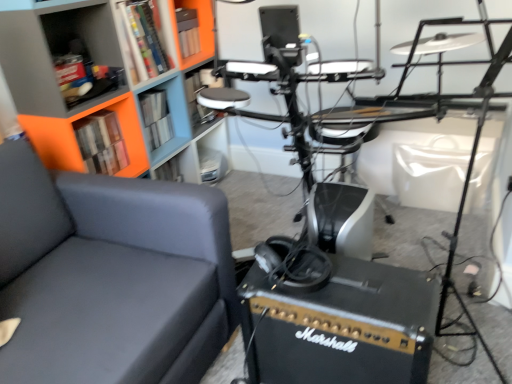
Question: Is matte plastic shelf at upper left, the 2th shelf in the back-to-front sequence, surrounded by orange matte bookcase at upper left?

Choices:
 (A) yes
 (B) no

Answer: (A)

Question: Can you confirm if orange matte bookcase at upper left is smaller than matte plastic shelf at upper left, the 2th shelf in the back-to-front sequence?

Choices:
 (A) yes
 (B) no

Answer: (B)

Question: Can you confirm if orange matte bookcase at upper left is positioned to the left of matte plastic shelf at upper left, acting as the first shelf starting from the front?

Choices:
 (A) no
 (B) yes

Answer: (A)

Question: Does orange matte bookcase at upper left have a lesser height compared to matte plastic shelf at upper left, acting as the first shelf starting from the front?

Choices:
 (A) no
 (B) yes

Answer: (A)

Question: Does orange matte bookcase at upper left have a greater width compared to matte plastic shelf at upper left, the 1th shelf in the left-to-right sequence?

Choices:
 (A) yes
 (B) no

Answer: (A)

Question: Considering their positions, is black matte marshall amplifier at lower right located in front of or behind hardcover book at upper left, which is counted as the second book, starting from the back?

Choices:
 (A) front
 (B) behind

Answer: (A)

Question: From a real-world perspective, relative to hardcover book at upper left, arranged as the 1th book when viewed from the front, is black matte marshall amplifier at lower right vertically above or below?

Choices:
 (A) below
 (B) above

Answer: (A)

Question: Considering the positions of black matte marshall amplifier at lower right and hardcover book at upper left, arranged as the 1th book when viewed from the front, in the image, is black matte marshall amplifier at lower right wider or thinner than hardcover book at upper left, arranged as the 1th book when viewed from the front,?

Choices:
 (A) thin
 (B) wide

Answer: (B)

Question: Considering the positions of point (272, 352) and point (87, 132), is point (272, 352) closer or farther from the camera than point (87, 132)?

Choices:
 (A) farther
 (B) closer

Answer: (B)

Question: Considering the relative positions of matte plastic shelf at center, placed as the first shelf when sorted from back to front, and hardcover book at upper left, which ranks as the 1th book in back-to-front order, in the image provided, is matte plastic shelf at center, placed as the first shelf when sorted from back to front, to the left or to the right of hardcover book at upper left, which ranks as the 1th book in back-to-front order,?

Choices:
 (A) left
 (B) right

Answer: (B)

Question: Considering the positions of point (199, 69) and point (159, 114), is point (199, 69) closer or farther from the camera than point (159, 114)?

Choices:
 (A) closer
 (B) farther

Answer: (B)

Question: Considering their positions, is matte plastic shelf at center, placed as the first shelf when sorted from back to front, located in front of or behind hardcover book at upper left, which ranks as the 1th book in back-to-front order?

Choices:
 (A) front
 (B) behind

Answer: (B)

Question: In terms of width, does matte plastic shelf at center, the 2th shelf when ordered from left to right, look wider or thinner when compared to hardcover book at upper left, which ranks as the 1th book in back-to-front order?

Choices:
 (A) wide
 (B) thin

Answer: (A)

Question: Is matte plastic shelf at center, which is the 1th shelf from right to left, bigger or smaller than matte plastic shelf at upper left, the 2th shelf in the back-to-front sequence?

Choices:
 (A) small
 (B) big

Answer: (A)

Question: Does point (202, 84) appear closer or farther from the camera than point (101, 91)?

Choices:
 (A) farther
 (B) closer

Answer: (A)